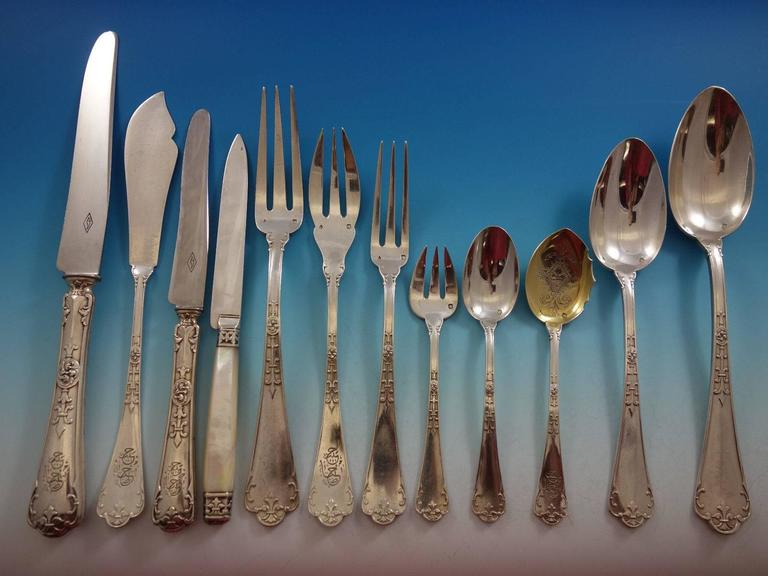
Where is `spoon`? spoon is located at coordinates [x=500, y=283], [x=560, y=282], [x=643, y=222], [x=709, y=194].